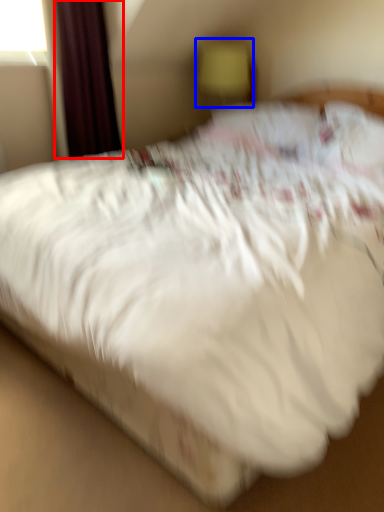
Question: Which object appears farthest to the camera in this image, curtain (highlighted by a red box) or table lamp (highlighted by a blue box)?

Choices:
 (A) curtain
 (B) table lamp

Answer: (B)